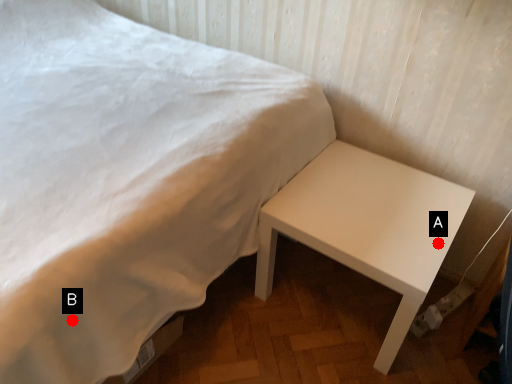
Question: Two points are circled on the image, labeled by A and B beside each circle. Which point is closer to the camera?

Choices:
 (A) A is closer
 (B) B is closer

Answer: (B)